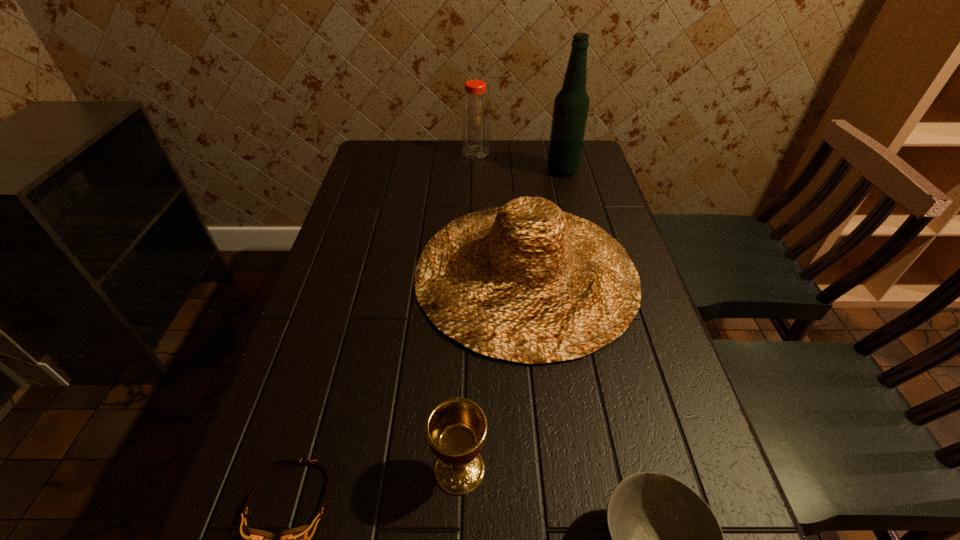
You are a GUI agent. You are given a task and a screenshot of the screen. Output one action in this format:
    pyautogui.click(x=<x>, y=<y>)
    Task: Click on the free location located 0.140m on the right of the third shortest object
    Image resolution: width=960 pixels, height=540 pixels.
    Given the screenshot: What is the action you would take?
    pyautogui.click(x=570, y=469)

The image size is (960, 540). What are the coordinates of `alcohol that is at the far edge` in the screenshot? It's located at (571, 105).

What are the coordinates of `bottle that is at the far edge` in the screenshot? It's located at (475, 112).

At what (x,y) coordinates should I click in order to perform the action: click on alcohol that is positioned at the right edge. Please return your answer as a coordinate pair (x, y). Looking at the image, I should click on (571, 105).

Find the location of `sunhat located at the right edge`. sunhat located at the right edge is located at coordinates (527, 282).

This screenshot has width=960, height=540. In order to click on object that is at the far right corner in this screenshot , I will do `click(571, 105)`.

Identify the location of vacant space at the left edge of the desktop. (358, 192).

This screenshot has height=540, width=960. Find the location of `vacant position at the right edge of the desktop`. vacant position at the right edge of the desktop is located at coordinates (671, 470).

Where is `vacant space at the far left corner`? vacant space at the far left corner is located at coordinates (407, 145).

Find the location of a particular element. The image size is (960, 540). free space at the far right corner of the desktop is located at coordinates (592, 173).